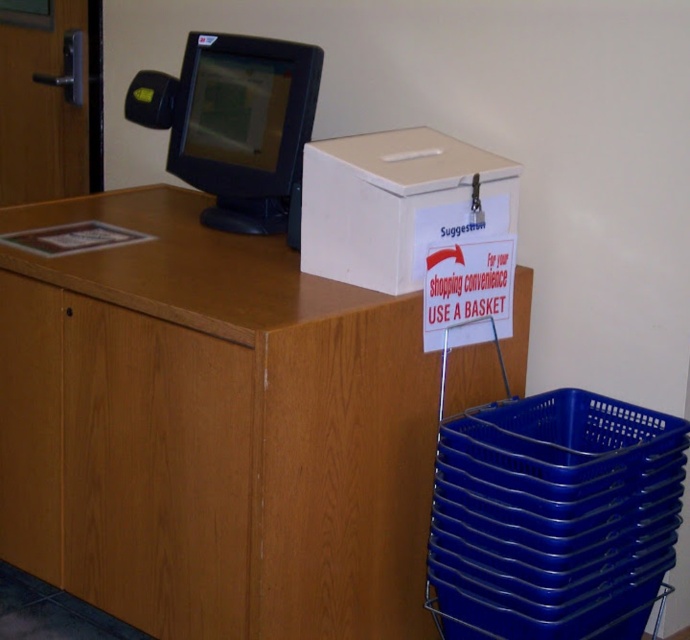
You are a customer in a store and see the wooden table at center and the blue plastic basket at lower right. Which object is located to the right of the other?

The wooden table at center is positioned on the left side of blue plastic basket at lower right, meaning the blue plastic basket at lower right is to the right of the wooden table at center.